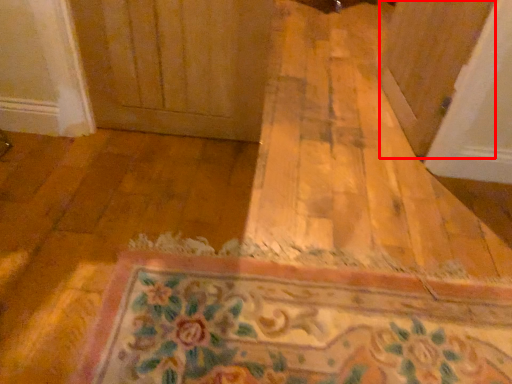
Question: Where is screen door (annotated by the red box) located in relation to bath mat in the image?

Choices:
 (A) right
 (B) left

Answer: (A)